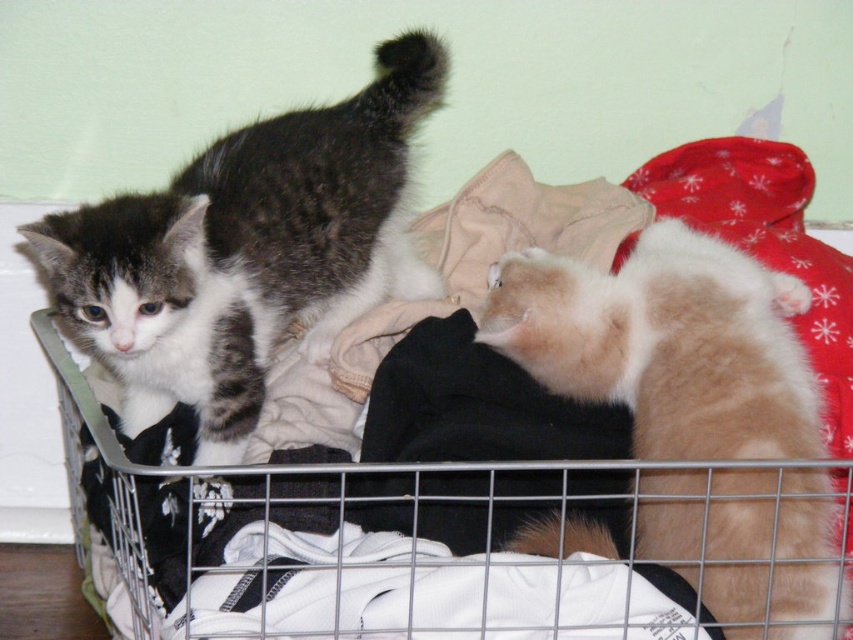
You are standing 1 meter away from the metallic silver shopping basket at center. Can you reach into the basket without moving your feet?

The metallic silver shopping basket at center is 97.37 centimeters from viewer, so yes, you can reach into it without moving your feet since it is slightly closer than 1 meter.